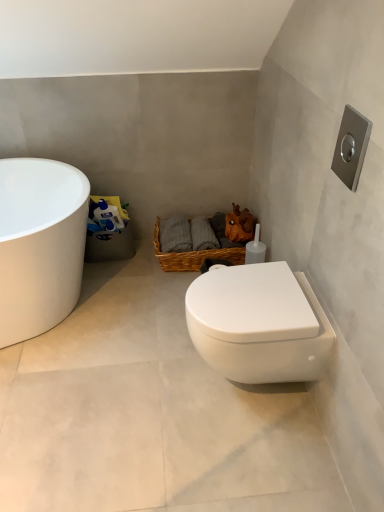
The width and height of the screenshot is (384, 512). Find the location of `free space above white glossy toilet at lower right (from a real-world perspective)`. free space above white glossy toilet at lower right (from a real-world perspective) is located at coordinates (130, 369).